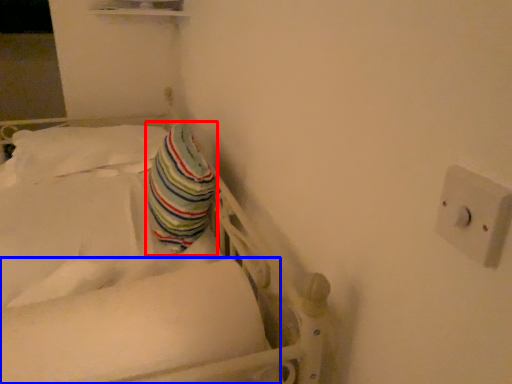
Question: Which of the following is the closest to the observer, throw pillow (highlighted by a red box) or mattress (highlighted by a blue box)?

Choices:
 (A) throw pillow
 (B) mattress

Answer: (B)